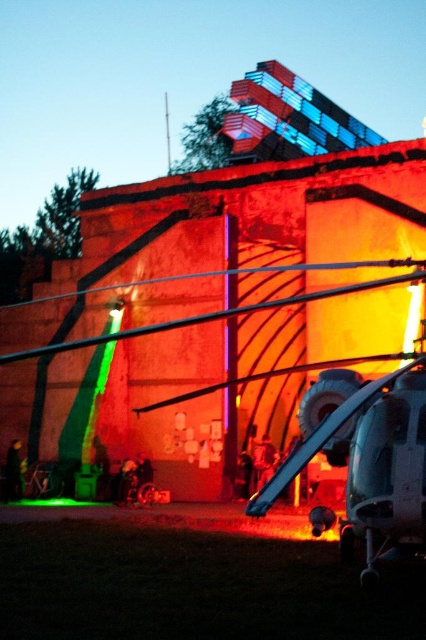
In the scene shown: Measure the distance between dark green fabric jacket at lower left and camera.

dark green fabric jacket at lower left is 70.11 meters from camera.

Is dark green fabric jacket at lower left to the right of smooth skin person at center from the viewer's perspective?

In fact, dark green fabric jacket at lower left is to the left of smooth skin person at center.

Locate an element on the screen. The image size is (426, 640). dark green fabric jacket at lower left is located at coordinates pyautogui.click(x=13, y=472).